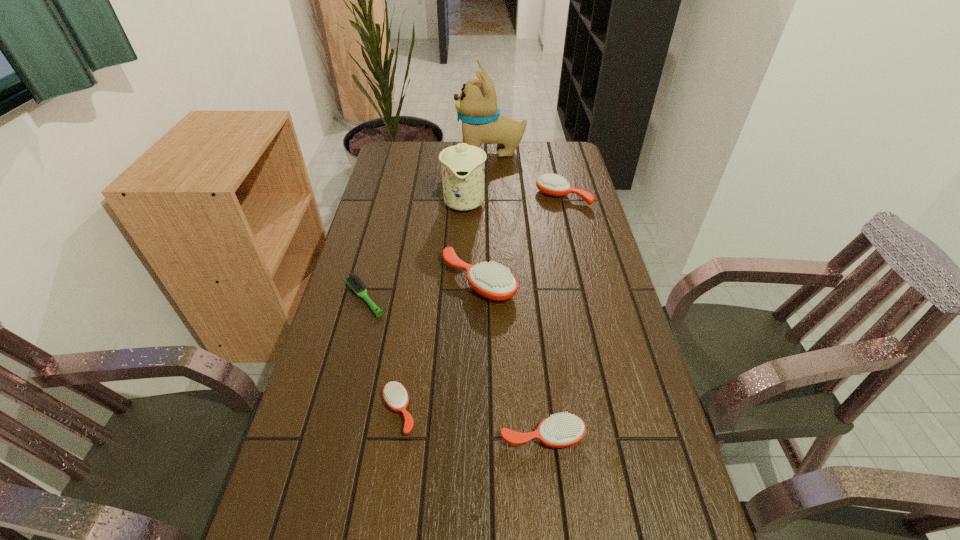
This screenshot has width=960, height=540. What are the coordinates of `the tallest object` in the screenshot? It's located at (476, 106).

Where is `beige puppy`? The image size is (960, 540). beige puppy is located at coordinates point(476,106).

Locate an element on the screen. The height and width of the screenshot is (540, 960). chinaware is located at coordinates (463, 166).

Find the location of a particular element. Image resolution: width=960 pixels, height=540 pixels. the tallest hairbrush is located at coordinates (493, 281).

In order to click on the third nearest orange hairbrush in this screenshot , I will do `click(493, 281)`.

You are a GUI agent. You are given a task and a screenshot of the screen. Output one action in this format:
    pyautogui.click(x=<x>, y=<y>)
    Task: Click on the farthest hairbrush
    The width and height of the screenshot is (960, 540).
    Given the screenshot: What is the action you would take?
    pyautogui.click(x=551, y=184)

Find the location of a particular element. This screenshot has width=960, height=540. the third smallest orange hairbrush is located at coordinates (551, 184).

Image resolution: width=960 pixels, height=540 pixels. Find the location of `the third tallest hairbrush`. the third tallest hairbrush is located at coordinates (561, 430).

Where is `the third biggest orange hairbrush`? This screenshot has width=960, height=540. the third biggest orange hairbrush is located at coordinates (561, 430).

Identify the location of the leftmost orange hairbrush. (395, 395).